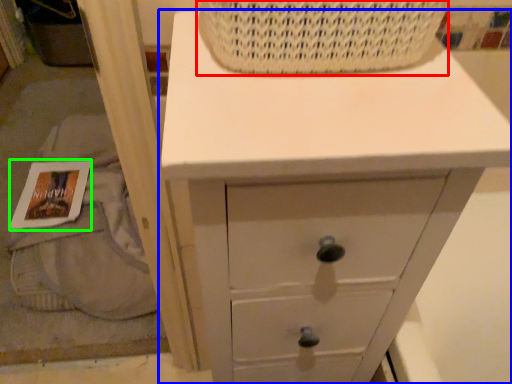
Question: Which object is the farthest from basket (highlighted by a red box)? Choose among these: chest of drawers (highlighted by a blue box) or magazine (highlighted by a green box).

Choices:
 (A) chest of drawers
 (B) magazine

Answer: (B)